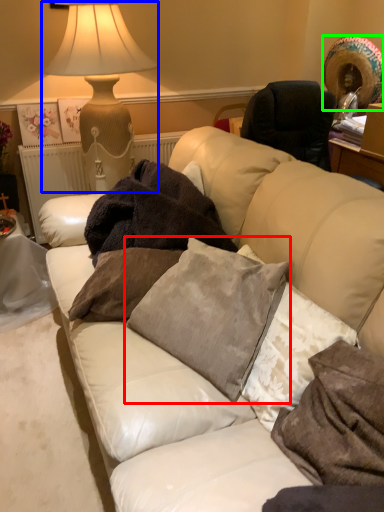
Question: Which object is positioned farthest from pillow (highlighted by a red box)? Select from table lamp (highlighted by a blue box) and straw hat (highlighted by a green box).

Choices:
 (A) table lamp
 (B) straw hat

Answer: (B)